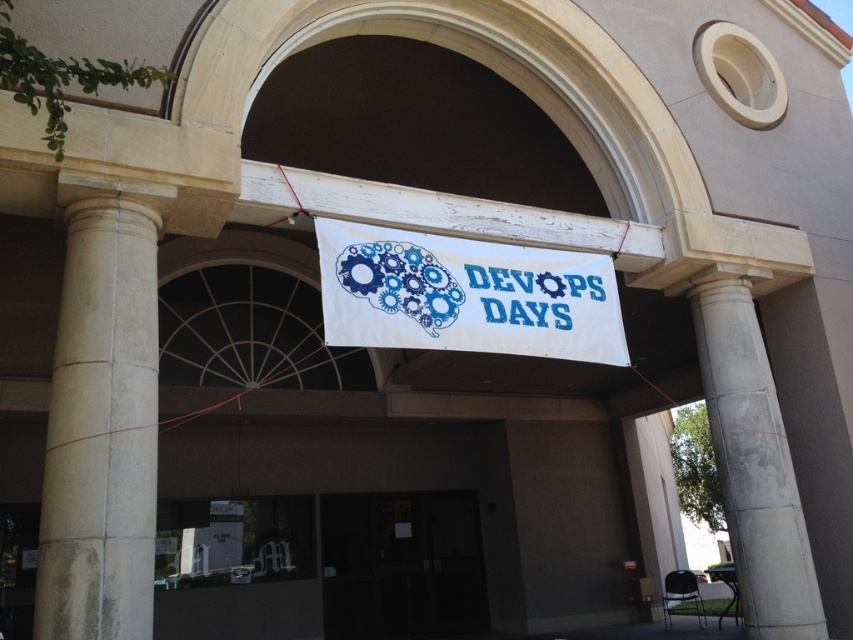
You are a delivery person approaching the entrance of the building. You need to pass through the transparent glass door at center. However, there is a white concrete pillar at right in your path. Based on the scene description, which object is closer to you as you approach the entrance, and does this affect your path to the door?

The white concrete pillar at right is closer to the viewer than the transparent glass door at center. This means the pillar is in your path, so you must navigate around it to reach the transparent glass door at center.